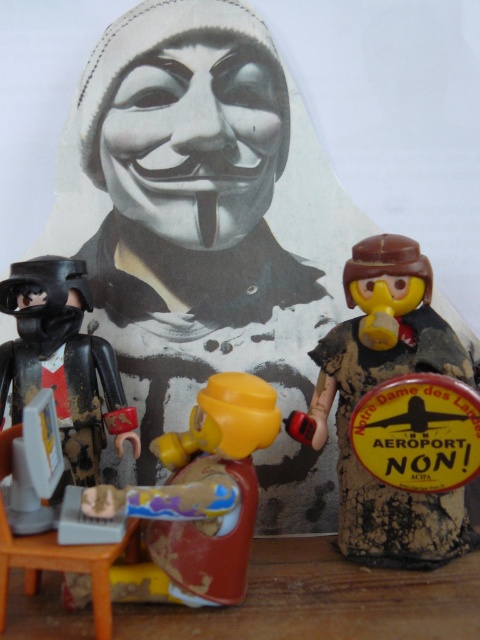
Question: Is wooden figure at right thinner than matte yellow figure at center?

Choices:
 (A) no
 (B) yes

Answer: (B)

Question: Which point is closer to the camera?

Choices:
 (A) black matte armor at left
 (B) matte yellow figure at center

Answer: (B)

Question: Which is nearer to the black matte armor at left?

Choices:
 (A) matte yellow figure at center
 (B) wooden figure at right

Answer: (A)

Question: Can you confirm if matte yellow figure at center is positioned below black matte armor at left?

Choices:
 (A) yes
 (B) no

Answer: (A)

Question: Does matte yellow figure at center appear on the right side of black matte armor at left?

Choices:
 (A) yes
 (B) no

Answer: (A)

Question: Which is nearer to the black matte armor at left?

Choices:
 (A) matte yellow figure at center
 (B) wooden figure at right

Answer: (A)